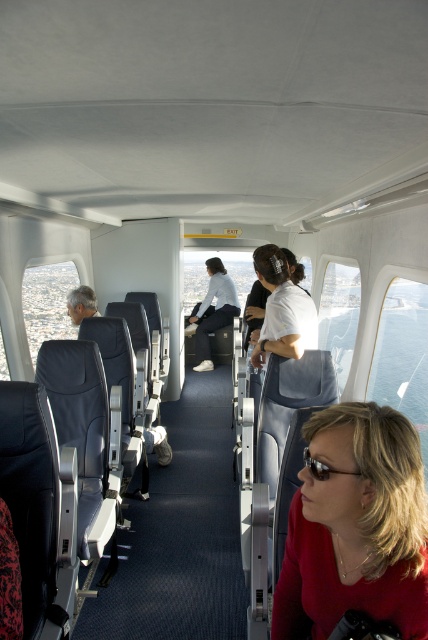
Question: Is the position of matte red shirt at lower right more distant than that of light blue fabric jacket at center?

Choices:
 (A) yes
 (B) no

Answer: (B)

Question: Which of the following is the farthest from the observer?

Choices:
 (A) light blue fabric jacket at center
 (B) matte red shirt at lower right

Answer: (A)

Question: Which of the following is the closest to the observer?

Choices:
 (A) (401, 628)
 (B) (196, 360)

Answer: (A)

Question: Does matte red shirt at lower right have a smaller size compared to light blue fabric jacket at center?

Choices:
 (A) no
 (B) yes

Answer: (B)

Question: In this image, where is matte red shirt at lower right located relative to light blue fabric jacket at center?

Choices:
 (A) left
 (B) right

Answer: (B)